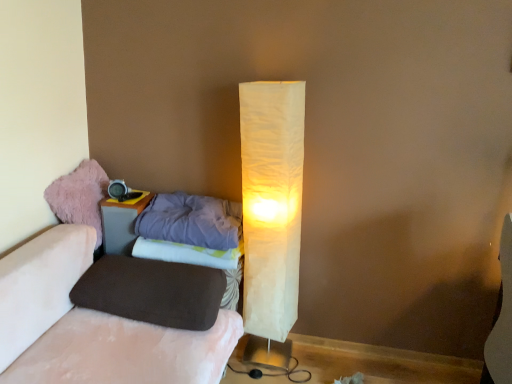
The height and width of the screenshot is (384, 512). I want to click on unoccupied region to the right of white paper lamp at center, so click(311, 363).